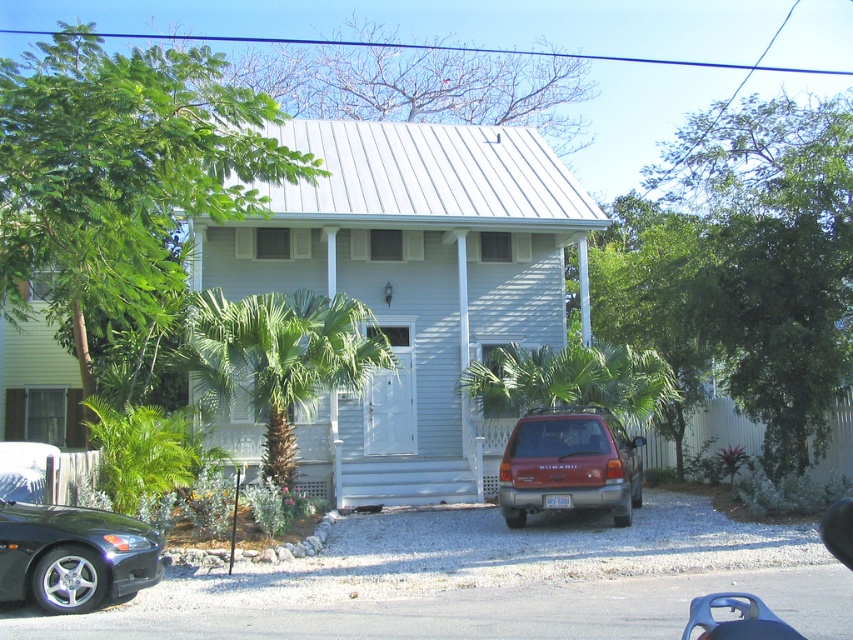
Question: Is gray asphalt driveway at lower center smaller than green leafy palm tree at center?

Choices:
 (A) yes
 (B) no

Answer: (A)

Question: Based on their relative distances, which object is farther from the green leafy palm tree at center?

Choices:
 (A) matte red suv at lower right
 (B) shiny black car at lower left

Answer: (B)

Question: Which of these objects is positioned closest to the gray asphalt driveway at lower center?

Choices:
 (A) shiny black car at lower left
 (B) green leafy palm tree at center
 (C) matte red suv at lower right

Answer: (A)

Question: Can you confirm if gray asphalt driveway at lower center is wider than green leafy palm tree at center?

Choices:
 (A) no
 (B) yes

Answer: (A)

Question: Which object appears closest to the camera in this image?

Choices:
 (A) matte red suv at lower right
 (B) shiny black car at lower left
 (C) green leafy palm tree at center

Answer: (B)

Question: Is gray asphalt driveway at lower center positioned in front of matte red suv at lower right?

Choices:
 (A) no
 (B) yes

Answer: (B)